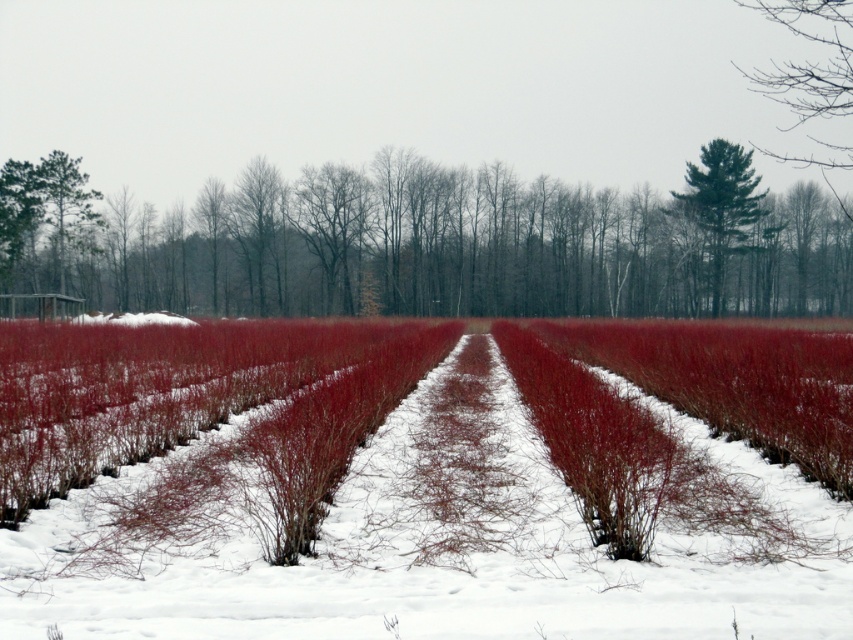
You are an arborist assessing a winter landscape. You notice the smooth bark tree at left and the green textured pine tree at upper center. Which tree has a wider trunk?

The smooth bark tree at left has a wider trunk than the green textured pine tree at upper center.

You are standing at the center of the field of shrubs covered in snow. You want to locate the smooth bark tree at left. In which direction should you look relative to your position?

You should look to the left relative to your position to locate the smooth bark tree at left.